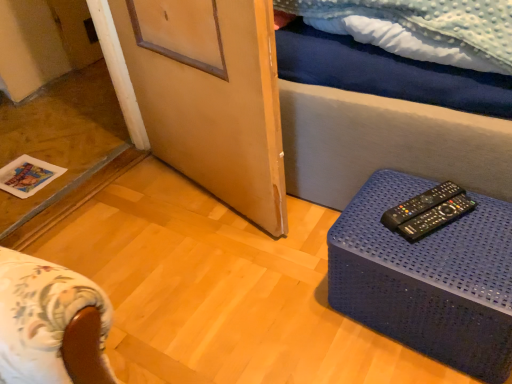
Locate an element on the screen. The image size is (512, 384). free space that is to the left of black plastic remote control at right, the 2th remote control when ordered from front to back is located at coordinates (370, 217).